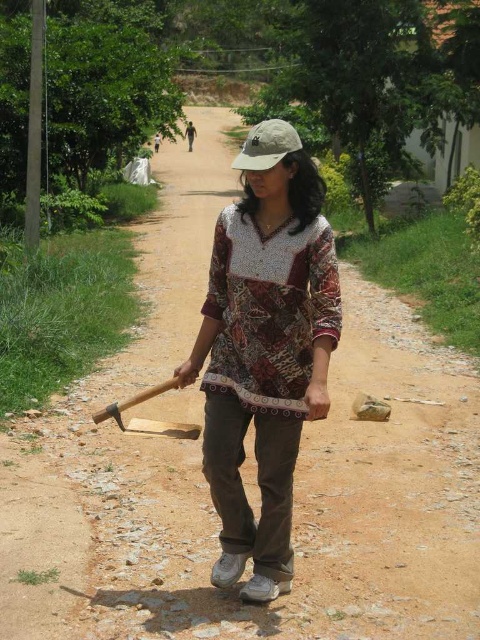
In the scene shown: Does batik fabric shirt at center have a greater height compared to khaki fabric baseball cap at center?

No.

Between batik fabric shirt at center and khaki fabric baseball cap at center, which one appears on the left side from the viewer's perspective?

From the viewer's perspective, batik fabric shirt at center appears more on the left side.

Who is more distant from viewer, (216, 298) or (241, 163)?

Positioned behind is point (216, 298).

The width and height of the screenshot is (480, 640). What are the coordinates of `batik fabric shirt at center` in the screenshot? It's located at (264, 358).